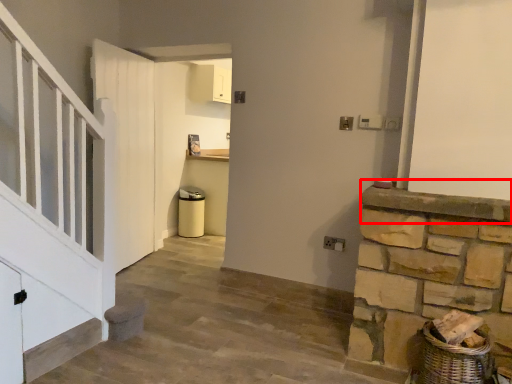
Question: From the image's perspective, where is mantle (annotated by the red box) located in relation to door in the image?

Choices:
 (A) above
 (B) below

Answer: (B)